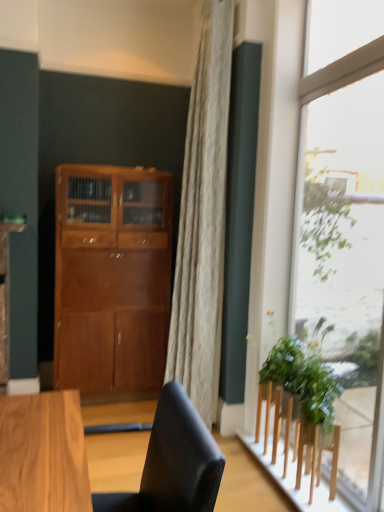
Image resolution: width=384 pixels, height=512 pixels. Find the location of `wooden stool at lower right`. wooden stool at lower right is located at coordinates (297, 437).

The image size is (384, 512). What do you see at coordinates (304, 375) in the screenshot?
I see `green leafy plant at right` at bounding box center [304, 375].

The image size is (384, 512). Find the location of `matte wood cabinet at center`. matte wood cabinet at center is located at coordinates (112, 278).

Considering the points (96, 289) and (289, 446), which point is in front, point (96, 289) or point (289, 446)?

The point (289, 446) is closer.

Between matte wood cabinet at center and wooden stool at lower right, which one has smaller size?

Smaller between the two is wooden stool at lower right.

Are matte wood cabinet at center and wooden stool at lower right far apart?

Yes.

From the image's perspective, is matte wood cabinet at center located beneath wooden stool at lower right?

No, from the image's perspective, matte wood cabinet at center is not below wooden stool at lower right.

Can you confirm if matte black chair at lower center is thinner than transparent glass window at right?

In fact, matte black chair at lower center might be wider than transparent glass window at right.

This screenshot has height=512, width=384. Identify the location of window that is above the matte black chair at lower center (from the image's perspective). (345, 225).

Is matte black chair at lower center facing away from transparent glass window at right?

Yes, transparent glass window at right is at the back of matte black chair at lower center.

Considering the relative sizes of matte black chair at lower center and transparent glass window at right in the image provided, is matte black chair at lower center smaller than transparent glass window at right?

Actually, matte black chair at lower center might be larger than transparent glass window at right.

From a real-world perspective, who is located lower, matte black chair at lower center or wooden stool at lower right?

wooden stool at lower right, from a real-world perspective.

From the image's perspective, is matte black chair at lower center above wooden stool at lower right?

Yes.

Is matte black chair at lower center aimed at wooden stool at lower right?

No.

Considering the relative sizes of matte black chair at lower center and wooden stool at lower right in the image provided, is matte black chair at lower center smaller than wooden stool at lower right?

Actually, matte black chair at lower center might be larger than wooden stool at lower right.

Is wooden stool at lower right aimed at matte black chair at lower center?

No, wooden stool at lower right is not facing towards matte black chair at lower center.

Would you say wooden stool at lower right is inside or outside matte black chair at lower center?

wooden stool at lower right is spatially situated outside matte black chair at lower center.

Which is behind, wooden stool at lower right or matte black chair at lower center?

wooden stool at lower right is behind.

Is matte wood cabinet at center positioned beyond the bounds of matte black chair at lower center?

Indeed, matte wood cabinet at center is completely outside matte black chair at lower center.

Considering the relative sizes of matte wood cabinet at center and matte black chair at lower center in the image provided, is matte wood cabinet at center taller than matte black chair at lower center?

Yes, matte wood cabinet at center is taller than matte black chair at lower center.

In the image, is matte wood cabinet at center positioned in front of or behind matte black chair at lower center?

matte wood cabinet at center is behind matte black chair at lower center.

Is the surface of green leafy plant at right in direct contact with matte black chair at lower center?

No, green leafy plant at right is not beside matte black chair at lower center.

Considering the sizes of green leafy plant at right and matte black chair at lower center in the image, is green leafy plant at right wider or thinner than matte black chair at lower center?

Considering their sizes, green leafy plant at right looks slimmer than matte black chair at lower center.

Locate an element on the screen. houseplant on the right of matte black chair at lower center is located at coordinates (304, 375).

Is green leafy plant at right bigger than matte black chair at lower center?

No.

From the image's perspective, is wooden stool at lower right over matte wood cabinet at center?

No, from the image's perspective, wooden stool at lower right is not on top of matte wood cabinet at center.

Is point (310, 481) closer to viewer compared to point (113, 293)?

That is True.

In the scene shown: Which is more to the left, wooden stool at lower right or matte wood cabinet at center?

Positioned to the left is matte wood cabinet at center.

Does wooden stool at lower right have a larger size compared to matte wood cabinet at center?

No, wooden stool at lower right is not bigger than matte wood cabinet at center.

This screenshot has height=512, width=384. In the image, there is a matte wood cabinet at center. Identify the location of furniture below it (from a real-world perspective). (297, 437).

The height and width of the screenshot is (512, 384). Find the location of `window above the matte black chair at lower center (from a real-world perspective)`. window above the matte black chair at lower center (from a real-world perspective) is located at coordinates (345, 225).

Looking at the image, which one is located further to green leafy plant at right, matte wood cabinet at center or transparent glass window at right?

matte wood cabinet at center.

Which object lies nearer to the anchor point matte wood cabinet at center, matte black chair at lower center or green leafy plant at right?

green leafy plant at right is positioned closer to the anchor matte wood cabinet at center.

Consider the image. Looking at the image, which one is located closer to transparent glass window at right, wooden stool at lower right or green leafy plant at right?

wooden stool at lower right lies closer to transparent glass window at right than the other object.

From the image, which object appears to be farther from green leafy plant at right, wooden stool at lower right or matte wood cabinet at center?

matte wood cabinet at center.

Looking at the image, which one is located closer to transparent glass window at right, matte black chair at lower center or wooden stool at lower right?

wooden stool at lower right.

Based on their spatial positions, is matte wood cabinet at center or matte black chair at lower center further from wooden stool at lower right?

Among the two, matte wood cabinet at center is located further to wooden stool at lower right.

From the image, which object appears to be farther from transparent glass window at right, wooden stool at lower right or matte black chair at lower center?

Based on the image, matte black chair at lower center appears to be further to transparent glass window at right.

Based on their spatial positions, is green leafy plant at right or transparent glass window at right further from wooden stool at lower right?

transparent glass window at right is positioned further to the anchor wooden stool at lower right.

Find the location of a particular element. This screenshot has height=512, width=384. chair between transparent glass window at right and wooden stool at lower right in the up-down direction is located at coordinates (173, 463).

The height and width of the screenshot is (512, 384). Find the location of `furniture between matte black chair at lower center and matte wood cabinet at center along the z-axis`. furniture between matte black chair at lower center and matte wood cabinet at center along the z-axis is located at coordinates (297, 437).

This screenshot has height=512, width=384. Identify the location of houseplant between transparent glass window at right and wooden stool at lower right from top to bottom. (304, 375).

Locate an element on the screen. The height and width of the screenshot is (512, 384). window positioned between matte black chair at lower center and matte wood cabinet at center from near to far is located at coordinates (345, 225).